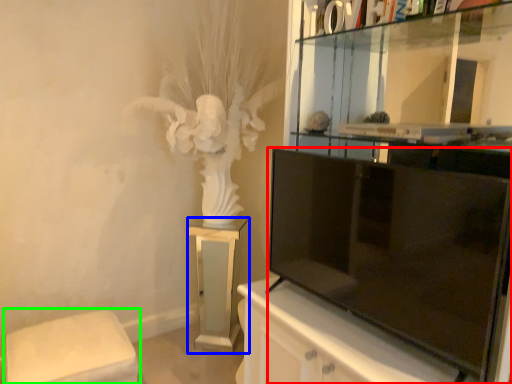
Question: Based on their relative distances, which object is farther from television (highlighted by a red box)? Choose from furniture (highlighted by a blue box) and furniture (highlighted by a green box).

Choices:
 (A) furniture
 (B) furniture

Answer: (B)